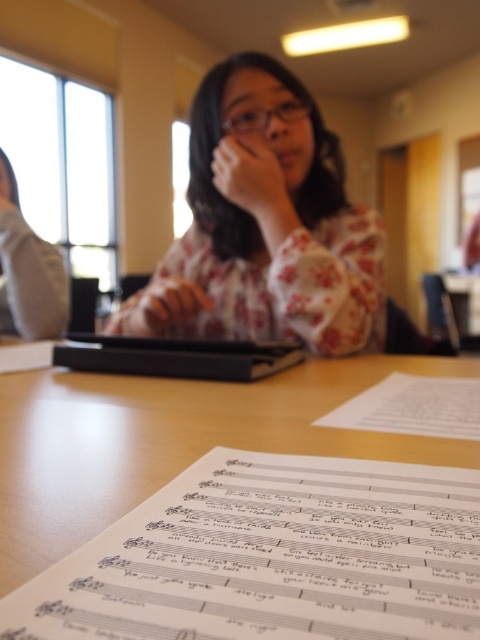
Question: Which of the following is the farthest from the observer?

Choices:
 (A) white paper at center
 (B) wooden table at center

Answer: (A)

Question: Which point is closer to the camera taking this photo?

Choices:
 (A) (371, 452)
 (B) (9, 211)
 (C) (356, 352)

Answer: (A)

Question: Is the position of gray fabric shirt at left less distant than that of white paper at center?

Choices:
 (A) no
 (B) yes

Answer: (A)

Question: Can you confirm if floral fabric shirt at center is thinner than gray fabric shirt at left?

Choices:
 (A) no
 (B) yes

Answer: (A)

Question: Which is farther from the wooden table at center?

Choices:
 (A) floral fabric shirt at center
 (B) gray fabric shirt at left

Answer: (B)

Question: Does gray fabric shirt at left lie in front of white paper at center?

Choices:
 (A) no
 (B) yes

Answer: (A)